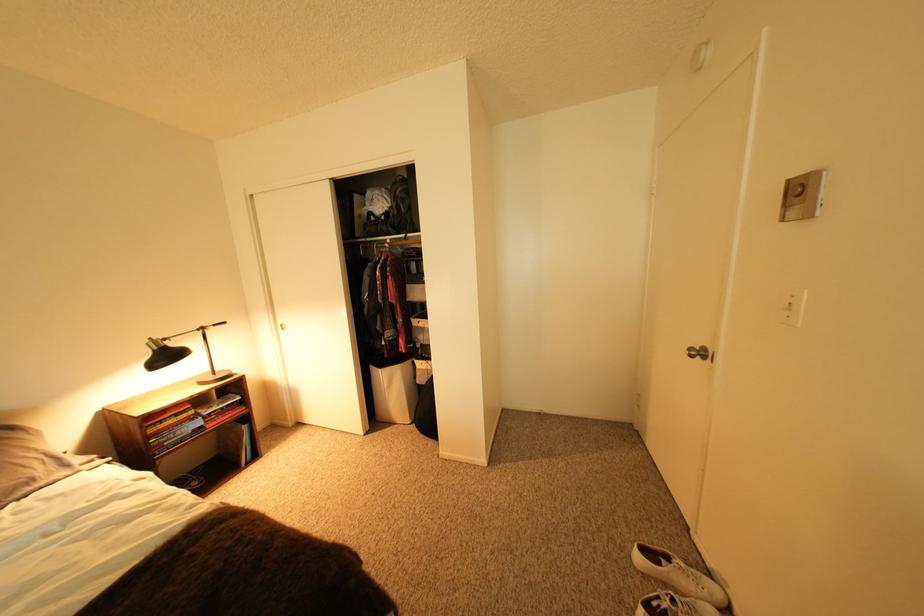
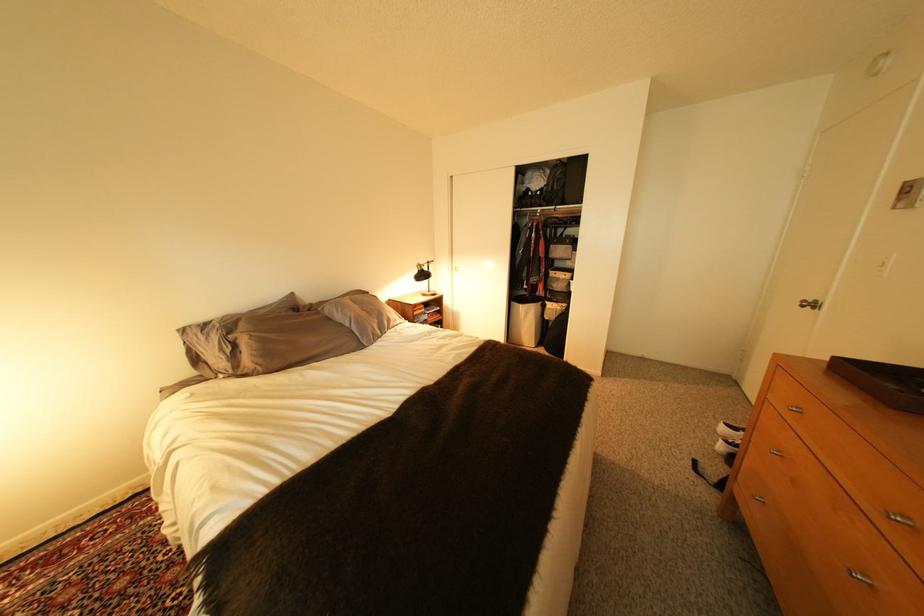
Find the pixel in the second image that matches the point at 394,214 in the first image.

(550, 191)